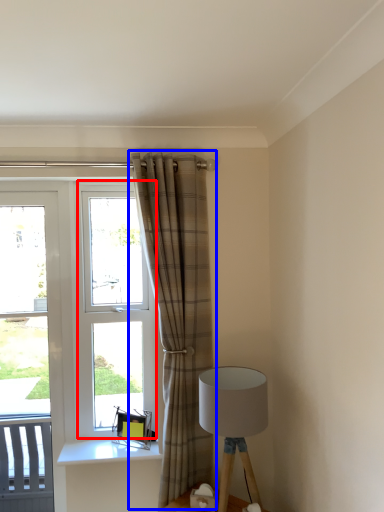
Question: Which of the following is the closest to the observer, window (highlighted by a red box) or curtain (highlighted by a blue box)?

Choices:
 (A) window
 (B) curtain

Answer: (B)